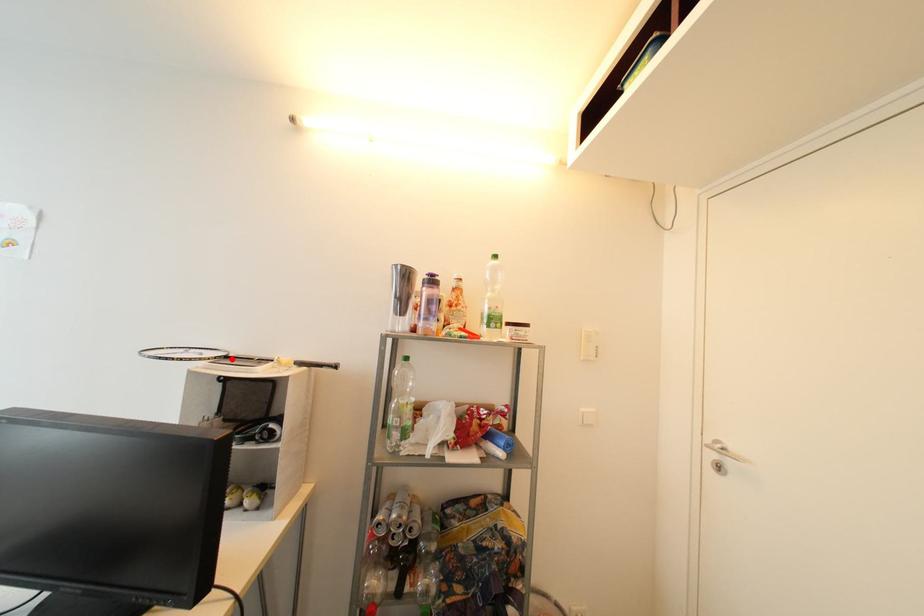
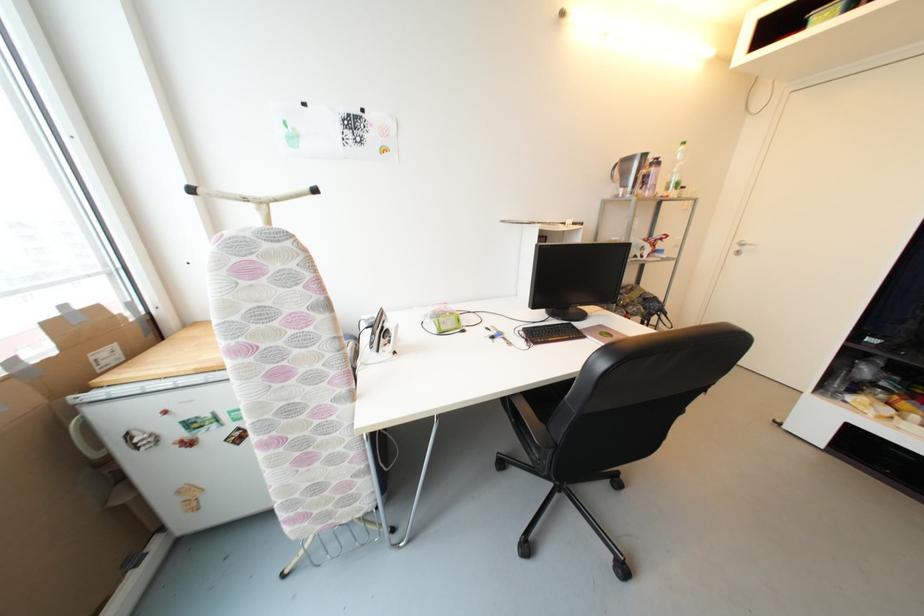
Question: I am providing you with two images of the same scene from different viewpoints. A red point is marked on the first image. At the location where the point appears in image 1, is it still visible in image 2?

Choices:
 (A) Yes
 (B) No

Answer: (B)